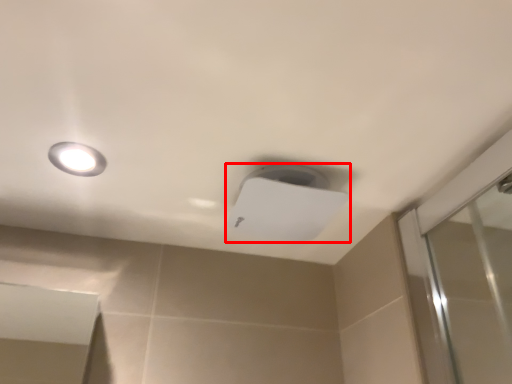
Question: In this image, where is lamp (annotated by the red box) located relative to droplight?

Choices:
 (A) right
 (B) left

Answer: (A)